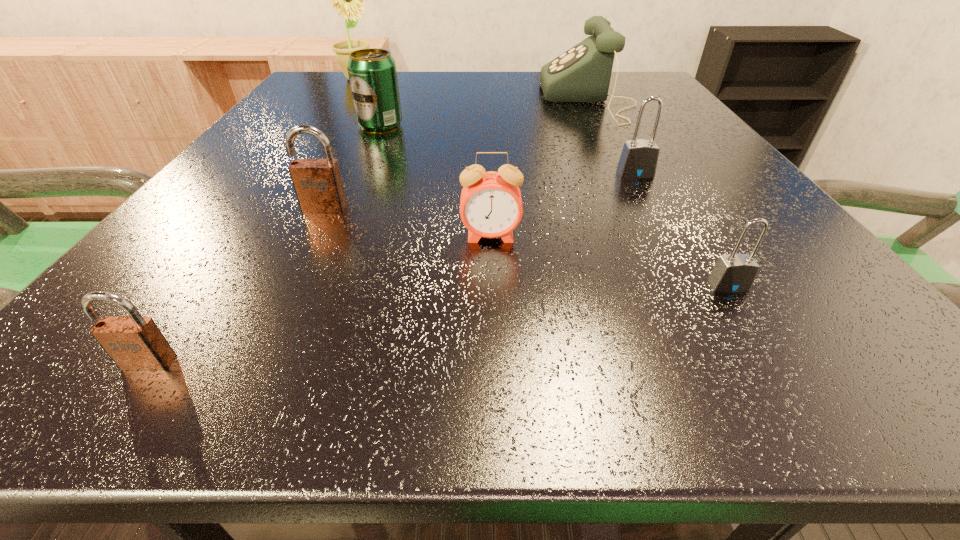
What are the coordinates of `free space located on the front-facing side of the right brown padlock` in the screenshot? It's located at (252, 355).

Find the location of `vacant space situated 0.110m on the face of the sixth farthest object`. vacant space situated 0.110m on the face of the sixth farthest object is located at coordinates (492, 306).

This screenshot has width=960, height=540. Find the location of `sunflower present at the far edge`. sunflower present at the far edge is located at coordinates (348, 0).

This screenshot has width=960, height=540. In order to click on telephone that is at the far edge in this screenshot , I will do `click(581, 74)`.

This screenshot has height=540, width=960. Identify the location of object located in the near edge section of the desktop. (134, 343).

Locate an element on the screen. sunflower located in the left edge section of the desktop is located at coordinates (348, 0).

The image size is (960, 540). In order to click on telephone located at the right edge in this screenshot , I will do (581, 74).

Locate an element on the screen. The width and height of the screenshot is (960, 540). object situated at the far left corner is located at coordinates (348, 0).

I want to click on object that is at the near left corner, so click(134, 343).

The width and height of the screenshot is (960, 540). What are the coordinates of `object present at the far right corner` in the screenshot? It's located at (581, 74).